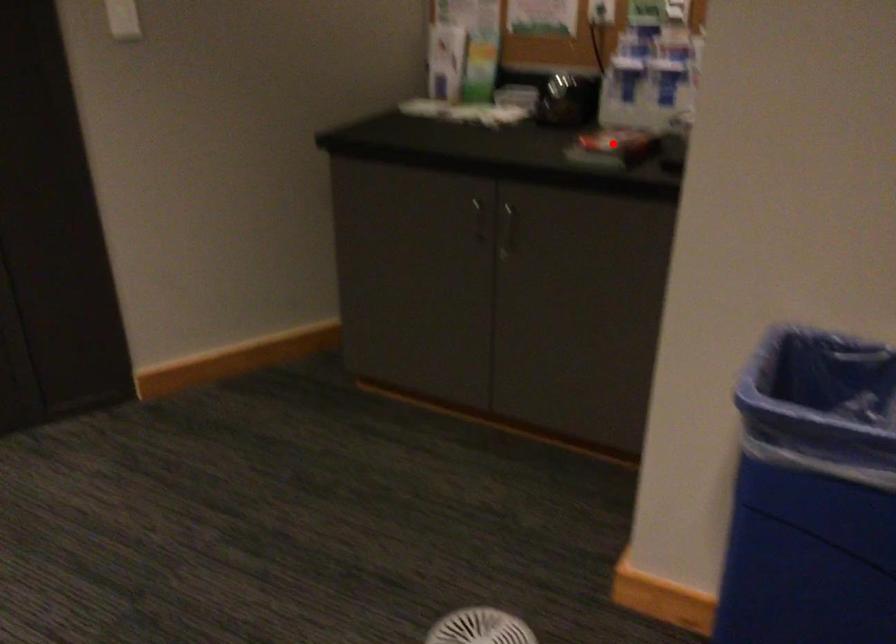
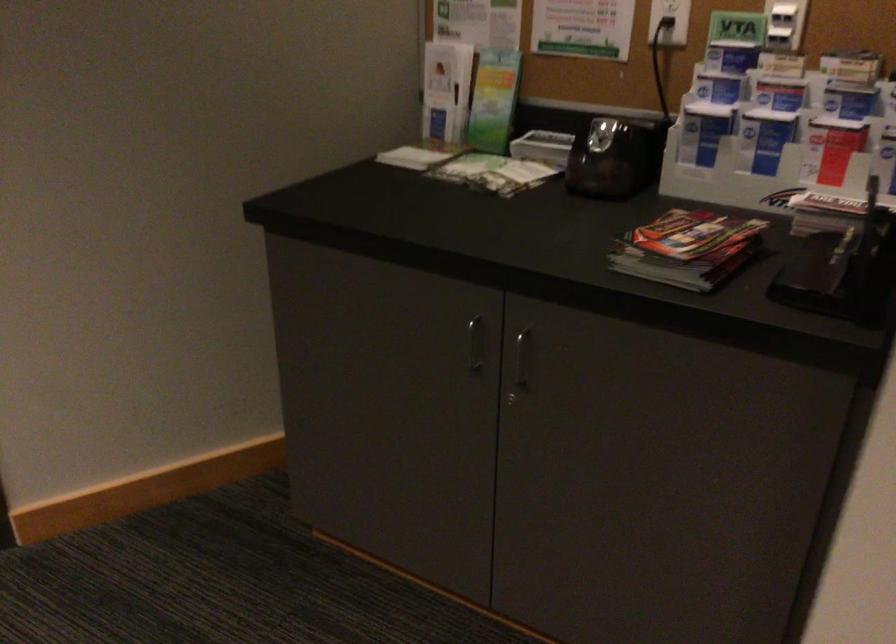
The point at the highlighted location is marked in the first image. Where is the corresponding point in the second image?

(687, 249)